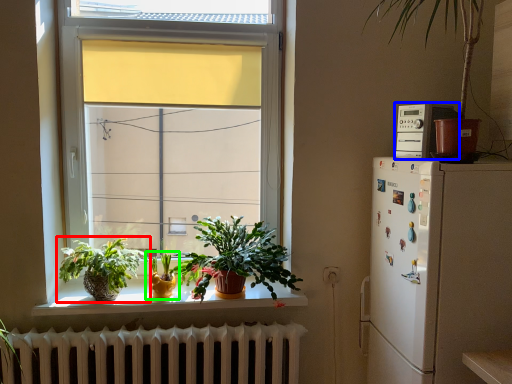
Question: Which object is the farthest from houseplant (highlighted by a red box)? Choose among these: appliance (highlighted by a blue box) or houseplant (highlighted by a green box).

Choices:
 (A) appliance
 (B) houseplant

Answer: (A)